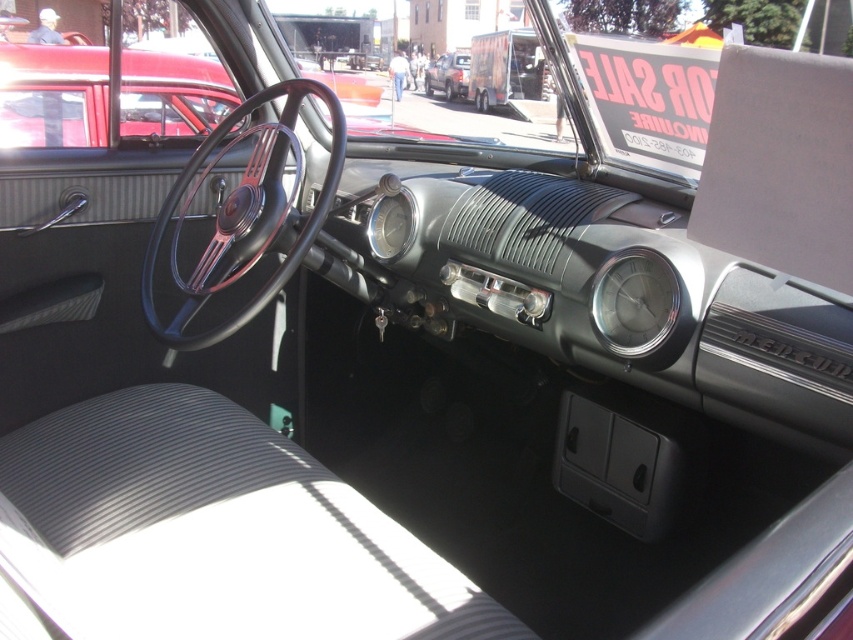
You are a mechanic working on a vintage car. You need to install a camera that must be placed exactly 1.5 meters away from the black leather steering wheel at center. According to the image, is the current position of the camera meeting the requirement?

The black leather steering wheel at center and camera are 1.61 meters apart from each other, so the current position of the camera is not meeting the requirement since 1.61 meters is more than 1.5 meters.

You are sitting in the driver seat of the vintage car and want to adjust the gear shift lever located on the central console. Which object, the black leather steering wheel at center or the matte black truck at center, is closer to your hands when reaching for the gear shift lever?

The black leather steering wheel at center is closer to the viewer than the matte black truck at center, so the black leather steering wheel at center is closer to your hands when reaching for the gear shift lever.

You are a mechanic working on a vintage car. You need to reach the metallic silver clock at center to adjust its settings. The tools you are holding are 1.5 meters long. Can you safely extend your arm to reach the clock without the tools hitting any part of the car?

The metallic silver clock at center is 1.42 meters away from the camera. Since the tools are 1.5 meters long, extending your arm with the tools would exceed the distance to the clock, potentially causing the tools to hit the car. It is not safe to proceed this way.